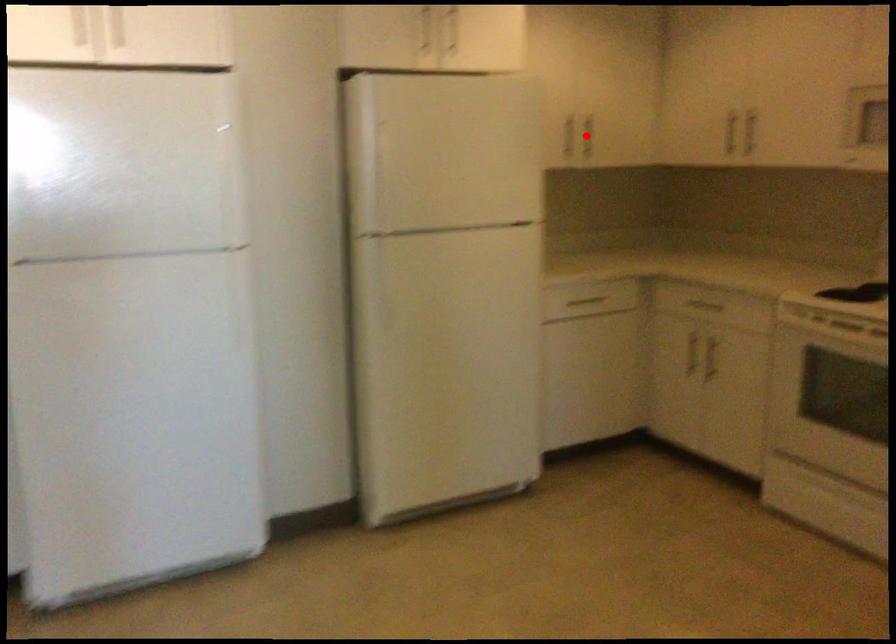
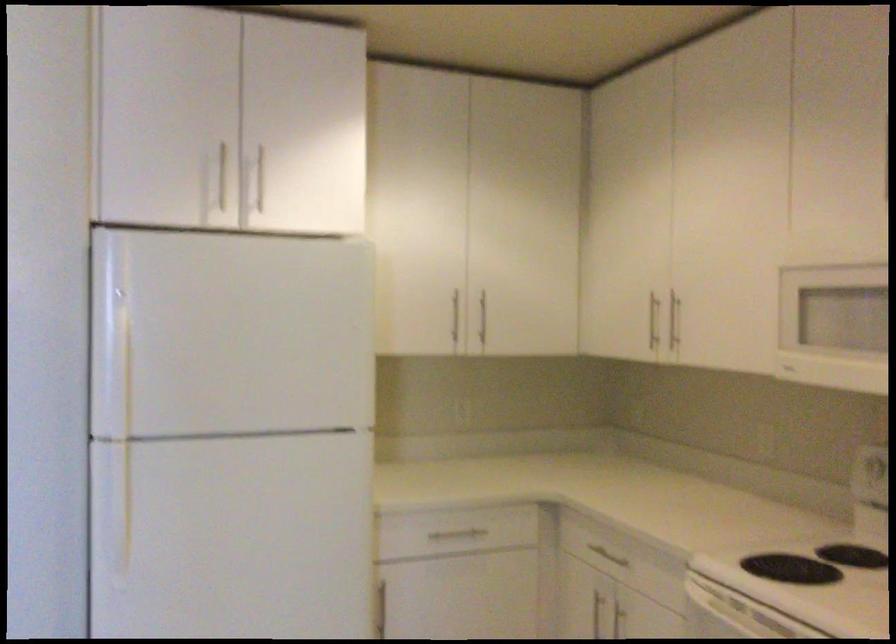
Question: I am providing you with two images of the same scene from different viewpoints. In image1, a red point is highlighted. Considering the same 3D point in image2, which of the following is correct?

Choices:
 (A) It is closer
 (B) It is farther

Answer: (A)